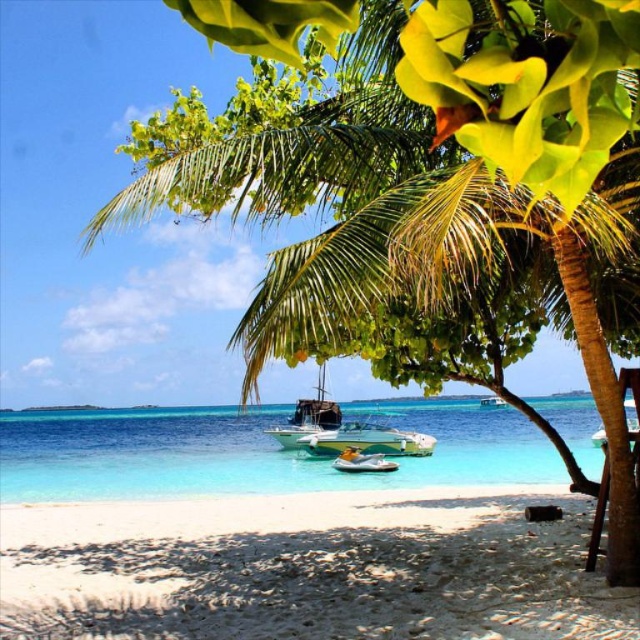
Question: Does clear blue water at lower left come in front of yellow rubber boat at center?

Choices:
 (A) yes
 (B) no

Answer: (A)

Question: Among these points, which one is nearest to the camera?

Choices:
 (A) (352, 451)
 (B) (321, 365)

Answer: (A)

Question: Which object is the farthest from the wooden sailboat at center?

Choices:
 (A) white glossy boat at center
 (B) yellow rubber boat at center

Answer: (A)

Question: Which point is closer to the camera taking this photo?

Choices:
 (A) (262, 413)
 (B) (358, 445)
 (C) (332, 461)

Answer: (C)

Question: Does wooden sailboat at center have a smaller size compared to yellow rubber boat at center?

Choices:
 (A) yes
 (B) no

Answer: (B)

Question: Does yellow rubber boat at center appear under white glossy boat at center?

Choices:
 (A) no
 (B) yes

Answer: (B)